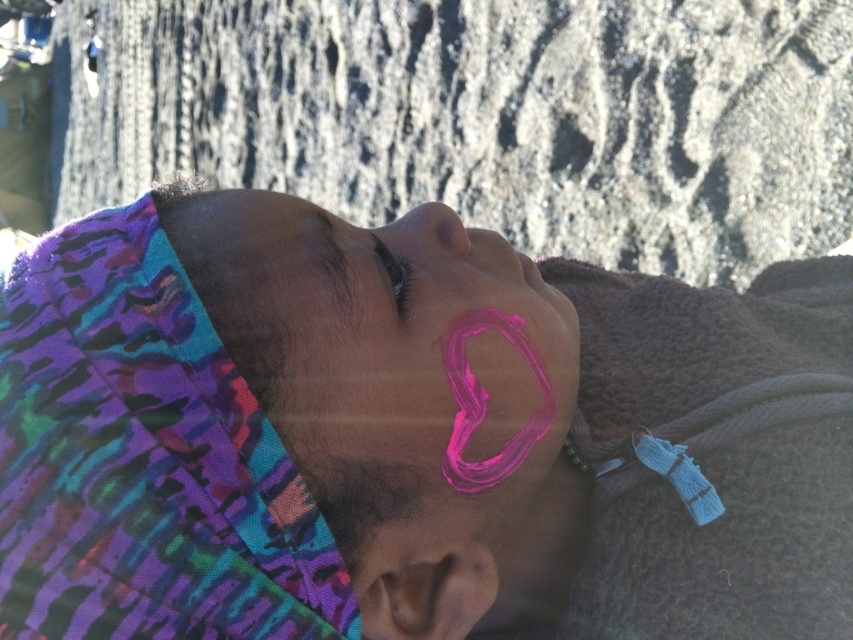
You are an artist examining the image. You notice the pink matte heart at center and the black matte eye at upper center. Which object is positioned to the right side of the other?

The pink matte heart at center is positioned to the right of the black matte eye at upper center.

From the picture: You are taking a photo of the scene and want to focus on the point closer to the camera. Which point should you choose between point (x=409, y=232) and point (x=389, y=264)?

Point (x=409, y=232) is further to the camera than point (x=389, y=264), so you should focus on point (x=389, y=264) since it is closer to the camera.

You are an artist trying to paint a similar scene. You have two stickers, a pink matte heart at center and a black matte eye at upper center. Which sticker should you place first if you want to ensure there is enough space for both?

The pink matte heart at center should be placed first since it occupies less space than the black matte eye at upper center, ensuring there is enough room for both stickers.